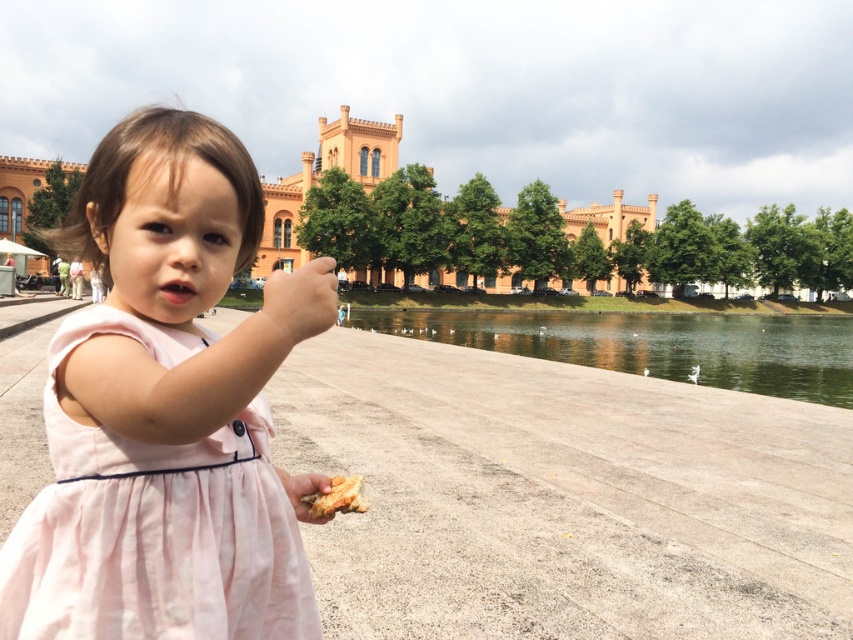
Is pink cotton dress at center smaller than golden crispy bread at lower center?

No, pink cotton dress at center is not smaller than golden crispy bread at lower center.

Is point (136, 317) less distant than point (345, 490)?

Yes, point (136, 317) is closer to viewer.

Is point (268, 506) closer to camera compared to point (341, 492)?

Yes.

The width and height of the screenshot is (853, 640). I want to click on pink cotton dress at center, so click(154, 524).

Is point (456, 344) farther from viewer compared to point (341, 502)?

Yes.

This screenshot has height=640, width=853. What do you see at coordinates (654, 344) in the screenshot?
I see `transparent water at lower center` at bounding box center [654, 344].

Who is more forward, (836, 333) or (302, 499)?

Point (302, 499) is more forward.

What are the coordinates of `transparent water at lower center` in the screenshot? It's located at (654, 344).

How much distance is there between pink cotton dress at center and transparent water at lower center?

The distance of pink cotton dress at center from transparent water at lower center is 74.31 meters.

From the picture: Is pink cotton dress at center closer to camera compared to transparent water at lower center?

Yes.

Is point (61, 544) positioned in front of point (399, 323)?

Yes.

You are a GUI agent. You are given a task and a screenshot of the screen. Output one action in this format:
    pyautogui.click(x=<x>, y=<y>)
    Task: Click on the pink cotton dress at center
    
    Given the screenshot: What is the action you would take?
    pyautogui.click(x=154, y=524)